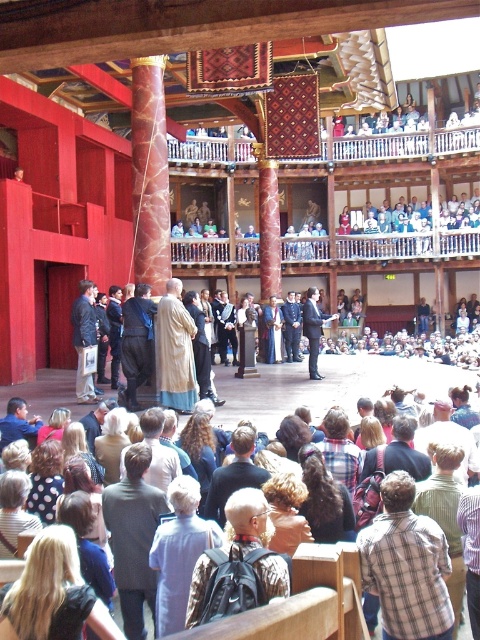
You are an audience member sitting in the theater and notice two characters on stage. One has blonde hair at lower left and the other is wearing a striped shirt at lower right. Which character has a larger feature?

The blonde hair at lower left is bigger than the striped shirt at lower right, so the character with blonde hair at lower left has a larger feature.